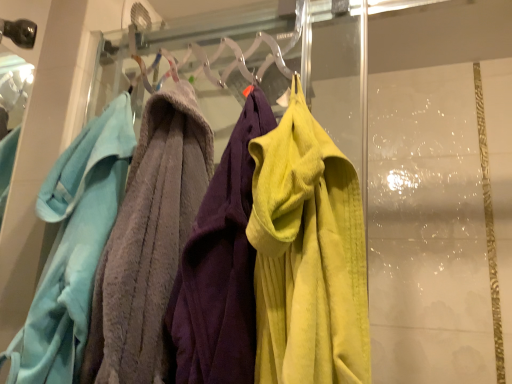
What do you see at coordinates (73, 246) in the screenshot?
I see `soft gray towel at left, which ranks as the 2th towel in right-to-left order` at bounding box center [73, 246].

You are a GUI agent. You are given a task and a screenshot of the screen. Output one action in this format:
    pyautogui.click(x=<x>, y=<y>)
    Task: Click on the soft gray towel at left, the first towel in the left-to-right sequence
    Image resolution: width=512 pixels, height=384 pixels.
    Given the screenshot: What is the action you would take?
    pyautogui.click(x=73, y=246)

Locate an element on the screen. soft yellow towel at center, the second towel positioned from the left is located at coordinates (307, 255).

The height and width of the screenshot is (384, 512). Describe the element at coordinates (307, 255) in the screenshot. I see `soft yellow towel at center, which is counted as the first towel, starting from the right` at that location.

Locate an element on the screen. The image size is (512, 384). soft gray towel at left, which ranks as the 2th towel in right-to-left order is located at coordinates (73, 246).

In the image, is soft yellow towel at center, the second towel positioned from the left, on the left side or the right side of soft gray towel at left, the first towel in the left-to-right sequence?

From the image, it's evident that soft yellow towel at center, the second towel positioned from the left, is to the right of soft gray towel at left, the first towel in the left-to-right sequence.

Which object is closer to the camera taking this photo, soft yellow towel at center, which is counted as the first towel, starting from the right, or soft gray towel at left, which ranks as the 2th towel in right-to-left order?

soft yellow towel at center, which is counted as the first towel, starting from the right, is in front.

Is point (364, 251) farther from camera compared to point (114, 173)?

No, (364, 251) is in front of (114, 173).

Based on the photo, from the image's perspective, is soft yellow towel at center, which is counted as the first towel, starting from the right, above soft gray towel at left, the first towel in the left-to-right sequence?

Yes, from the image's perspective, soft yellow towel at center, which is counted as the first towel, starting from the right, is on top of soft gray towel at left, the first towel in the left-to-right sequence.

From a real-world perspective, is soft yellow towel at center, which is counted as the first towel, starting from the right, positioned under soft gray towel at left, the first towel in the left-to-right sequence, based on gravity?

No, from a real-world perspective, soft yellow towel at center, which is counted as the first towel, starting from the right, is not under soft gray towel at left, the first towel in the left-to-right sequence.

Considering the sizes of soft yellow towel at center, which is counted as the first towel, starting from the right, and soft gray towel at left, the first towel in the left-to-right sequence, in the image, is soft yellow towel at center, which is counted as the first towel, starting from the right, wider or thinner than soft gray towel at left, the first towel in the left-to-right sequence,?

In the image, soft yellow towel at center, which is counted as the first towel, starting from the right, appears to be wider than soft gray towel at left, the first towel in the left-to-right sequence.

Based on the photo, which of these two, soft yellow towel at center, the second towel positioned from the left, or soft gray towel at left, the first towel in the left-to-right sequence, stands taller?

With more height is soft gray towel at left, the first towel in the left-to-right sequence.

Is soft yellow towel at center, which is counted as the first towel, starting from the right, smaller than soft gray towel at left, the first towel in the left-to-right sequence?

Incorrect, soft yellow towel at center, which is counted as the first towel, starting from the right, is not smaller in size than soft gray towel at left, the first towel in the left-to-right sequence.

Would you say soft yellow towel at center, the second towel positioned from the left, is inside or outside soft gray towel at left, which ranks as the 2th towel in right-to-left order?

soft yellow towel at center, the second towel positioned from the left, is not inside soft gray towel at left, which ranks as the 2th towel in right-to-left order, it's outside.

From the picture: Are soft yellow towel at center, which is counted as the first towel, starting from the right, and soft gray towel at left, the first towel in the left-to-right sequence, beside each other?

They are not placed beside each other.

Is soft yellow towel at center, the second towel positioned from the left, aimed at soft gray towel at left, which ranks as the 2th towel in right-to-left order?

No.

What's the angular difference between soft yellow towel at center, which is counted as the first towel, starting from the right, and soft gray towel at left, which ranks as the 2th towel in right-to-left order,'s facing directions?

The angular difference between soft yellow towel at center, which is counted as the first towel, starting from the right, and soft gray towel at left, which ranks as the 2th towel in right-to-left order, is 0.00217 degrees.

Measure the distance from soft yellow towel at center, which is counted as the first towel, starting from the right, to soft gray towel at left, the first towel in the left-to-right sequence.

A distance of 15.18 inches exists between soft yellow towel at center, which is counted as the first towel, starting from the right, and soft gray towel at left, the first towel in the left-to-right sequence.

Identify the location of towel below the soft yellow towel at center, the second towel positioned from the left (from a real-world perspective). Image resolution: width=512 pixels, height=384 pixels. click(x=73, y=246).

Consider the image. Is soft gray towel at left, which ranks as the 2th towel in right-to-left order, to the right of soft yellow towel at center, which is counted as the first towel, starting from the right, from the viewer's perspective?

Incorrect, soft gray towel at left, which ranks as the 2th towel in right-to-left order, is not on the right side of soft yellow towel at center, which is counted as the first towel, starting from the right.

Is the position of soft gray towel at left, the first towel in the left-to-right sequence, less distant than that of soft yellow towel at center, the second towel positioned from the left?

No, soft gray towel at left, the first towel in the left-to-right sequence, is behind soft yellow towel at center, the second towel positioned from the left.

Is point (69, 285) farther from viewer compared to point (290, 129)?

Yes, point (69, 285) is farther from viewer.

From the picture: From the image's perspective, is soft gray towel at left, the first towel in the left-to-right sequence, above soft yellow towel at center, the second towel positioned from the left?

Incorrect, from the image's perspective, soft gray towel at left, the first towel in the left-to-right sequence, is lower than soft yellow towel at center, the second towel positioned from the left.

Looking at this image, from a real-world perspective, between soft gray towel at left, the first towel in the left-to-right sequence, and soft yellow towel at center, which is counted as the first towel, starting from the right, who is vertically higher?

From a 3D spatial view, soft yellow towel at center, which is counted as the first towel, starting from the right, is above.

Considering the sizes of objects soft gray towel at left, which ranks as the 2th towel in right-to-left order, and soft yellow towel at center, which is counted as the first towel, starting from the right, in the image provided, who is wider, soft gray towel at left, which ranks as the 2th towel in right-to-left order, or soft yellow towel at center, which is counted as the first towel, starting from the right,?

Wider between the two is soft yellow towel at center, which is counted as the first towel, starting from the right.

Can you confirm if soft gray towel at left, which ranks as the 2th towel in right-to-left order, is taller than soft yellow towel at center, which is counted as the first towel, starting from the right?

Yes, soft gray towel at left, which ranks as the 2th towel in right-to-left order, is taller than soft yellow towel at center, which is counted as the first towel, starting from the right.

Considering the sizes of objects soft gray towel at left, which ranks as the 2th towel in right-to-left order, and soft yellow towel at center, which is counted as the first towel, starting from the right, in the image provided, who is bigger, soft gray towel at left, which ranks as the 2th towel in right-to-left order, or soft yellow towel at center, which is counted as the first towel, starting from the right,?

Bigger between the two is soft yellow towel at center, which is counted as the first towel, starting from the right.

Does soft gray towel at left, which ranks as the 2th towel in right-to-left order, contain soft yellow towel at center, the second towel positioned from the left?

No, soft yellow towel at center, the second towel positioned from the left, is not a part of soft gray towel at left, which ranks as the 2th towel in right-to-left order.

Is there a large distance between soft gray towel at left, which ranks as the 2th towel in right-to-left order, and soft yellow towel at center, which is counted as the first towel, starting from the right?

No, soft gray towel at left, which ranks as the 2th towel in right-to-left order, is not far from soft yellow towel at center, which is counted as the first towel, starting from the right.

Could you tell me if soft gray towel at left, the first towel in the left-to-right sequence, is turned towards soft yellow towel at center, which is counted as the first towel, starting from the right?

No, soft gray towel at left, the first towel in the left-to-right sequence, is not oriented towards soft yellow towel at center, which is counted as the first towel, starting from the right.

You are a GUI agent. You are given a task and a screenshot of the screen. Output one action in this format:
    pyautogui.click(x=<x>, y=<y>)
    Task: Click on the towel on the right of soft gray towel at left, which ranks as the 2th towel in right-to-left order
    This screenshot has height=384, width=512.
    Given the screenshot: What is the action you would take?
    pyautogui.click(x=307, y=255)

You are a GUI agent. You are given a task and a screenshot of the screen. Output one action in this format:
    pyautogui.click(x=<x>, y=<y>)
    Task: Click on the towel behind the soft yellow towel at center, which is counted as the first towel, starting from the right
    
    Given the screenshot: What is the action you would take?
    pyautogui.click(x=73, y=246)

Find the location of a particular element. This screenshot has height=384, width=512. towel that appears above the soft gray towel at left, which ranks as the 2th towel in right-to-left order (from the image's perspective) is located at coordinates (307, 255).